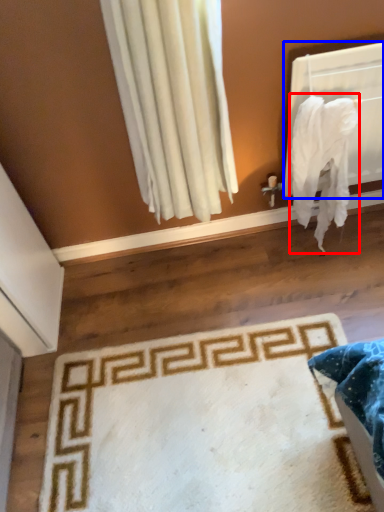
Question: Which of the following is the closest to the observer, blanket (highlighted by a red box) or window screen (highlighted by a blue box)?

Choices:
 (A) blanket
 (B) window screen

Answer: (A)